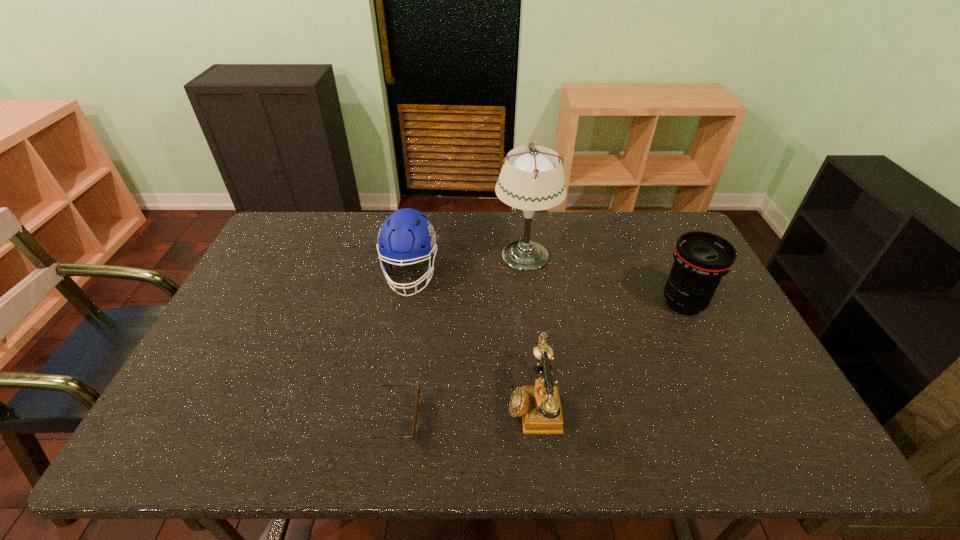
Identify the location of vacant space in between the telephone and the rightmost object. The image size is (960, 540). (609, 353).

Locate an element on the screen. unoccupied area between the football helmet and the telephoto lens is located at coordinates coord(547,288).

Locate an element on the screen. This screenshot has width=960, height=540. vacant area between the rightmost object and the shortest object is located at coordinates (539, 361).

The height and width of the screenshot is (540, 960). What are the coordinates of `vacant point located between the football helmet and the second shortest object` in the screenshot? It's located at (472, 338).

Identify the location of object that stands as the closest to the spectacles. (539, 406).

Where is `object identified as the fourth closest to the football helmet`? The image size is (960, 540). object identified as the fourth closest to the football helmet is located at coordinates (701, 259).

Image resolution: width=960 pixels, height=540 pixels. What are the coordinates of `free region that satisfies the following two spatial constraints: 1. on the lampshade of the lampshade; 2. on the left side of the telephoto lens` in the screenshot? It's located at (531, 303).

Locate an element on the screen. free location that satisfies the following two spatial constraints: 1. on the lampshade of the lampshade; 2. on the face guard of the football helmet is located at coordinates (527, 274).

This screenshot has width=960, height=540. Identify the location of vacant point that satisfies the following two spatial constraints: 1. on the lampshade of the tallest object; 2. on the back side of the telephoto lens. [x=531, y=303].

At what (x,y) coordinates should I click in order to perform the action: click on free space that satisfies the following two spatial constraints: 1. on the face guard of the rightmost object; 2. on the right side of the football helmet. Please return your answer as a coordinate pair (x, y). This screenshot has height=540, width=960. Looking at the image, I should click on (405, 303).